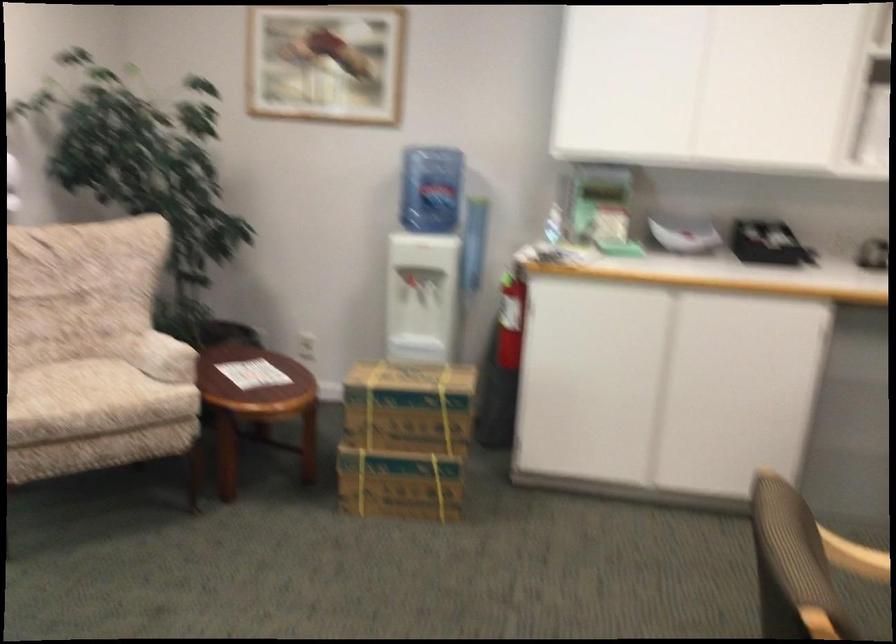
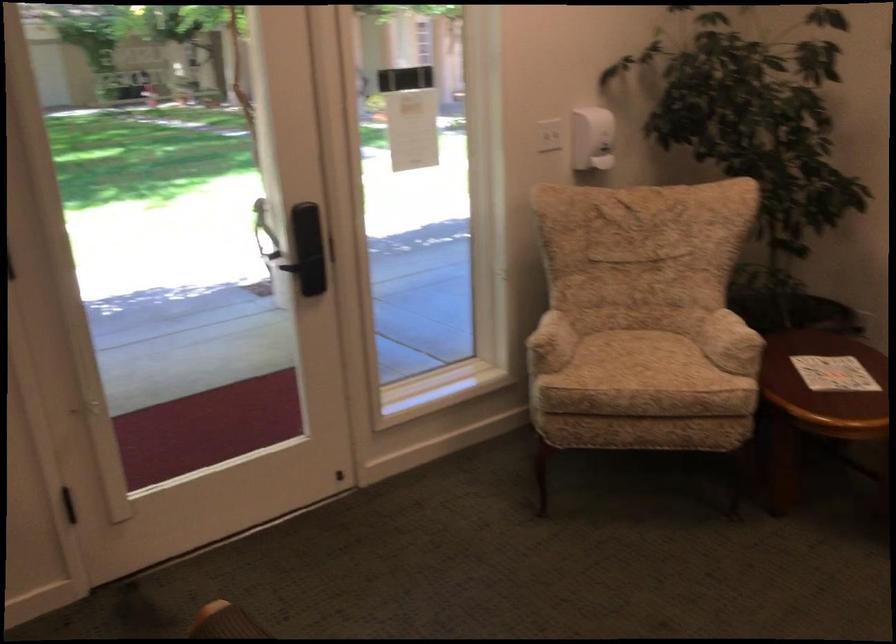
The point at [251,371] is marked in the first image. Where is the corresponding point in the second image?

(833, 373)